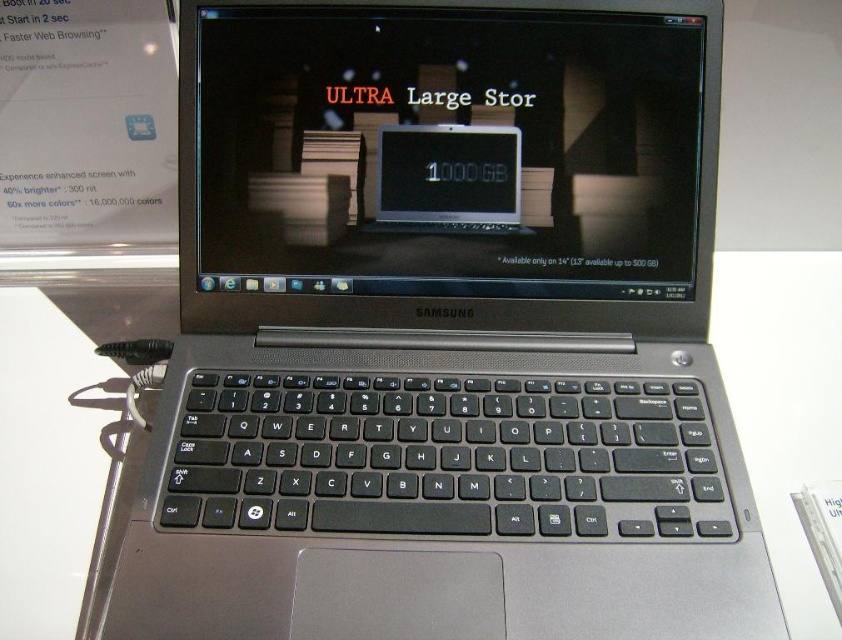
Describe the element at coordinates (450, 150) in the screenshot. I see `satin black laptop at center` at that location.

Who is shorter, satin black laptop at center or black glossy screen at center?

Standing shorter between the two is black glossy screen at center.

Is point (254, 10) positioned after point (478, 150)?

That is False.

Where is `satin black laptop at center`? The height and width of the screenshot is (640, 842). satin black laptop at center is located at coordinates [x=450, y=150].